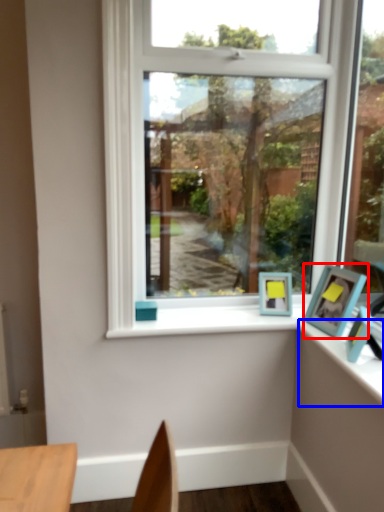
Question: Which object appears farthest to the camera in this image, picture frame (highlighted by a red box) or counter top (highlighted by a blue box)?

Choices:
 (A) picture frame
 (B) counter top

Answer: (A)